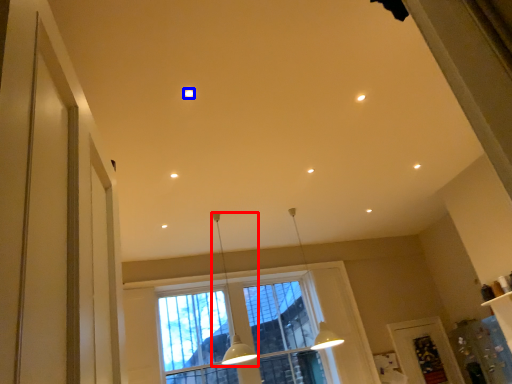
Question: Which object appears closest to the camera in this image, lamp (highlighted by a red box) or lighting (highlighted by a blue box)?

Choices:
 (A) lamp
 (B) lighting

Answer: (B)